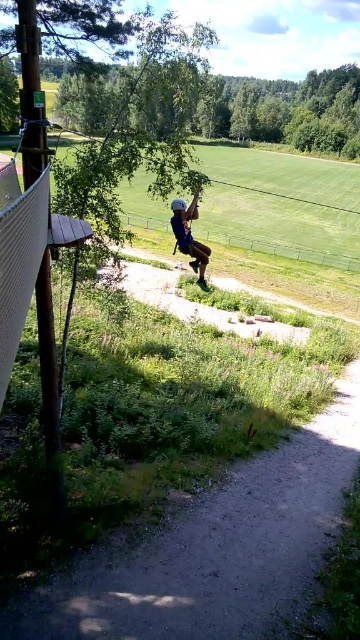
Which is in front, point (336, 403) or point (196, 209)?

Point (336, 403) is in front.

Does point (263, 522) come behind point (178, 241)?

No.

This screenshot has height=640, width=360. I want to click on dirt/gravel path at lower center, so click(x=213, y=548).